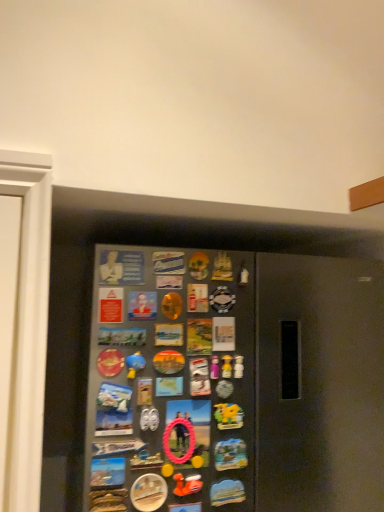
Question: Considering the relative positions of rubber duck at center and matte plastic bust at upper center, marked as the 1th button in a top-to-bottom arrangement, in the image provided, is rubber duck at center to the left of matte plastic bust at upper center, marked as the 1th button in a top-to-bottom arrangement, from the viewer's perspective?

Choices:
 (A) no
 (B) yes

Answer: (A)

Question: Does rubber duck at center have a greater width compared to matte plastic bust at upper center, marked as the 1th button in a top-to-bottom arrangement?

Choices:
 (A) yes
 (B) no

Answer: (A)

Question: Is rubber duck at center looking in the opposite direction of matte plastic bust at upper center, marked as the 1th button in a top-to-bottom arrangement?

Choices:
 (A) yes
 (B) no

Answer: (B)

Question: Does rubber duck at center appear on the right side of matte plastic bust at upper center, marked as the 1th button in a top-to-bottom arrangement?

Choices:
 (A) no
 (B) yes

Answer: (B)

Question: Is matte plastic bust at upper center, positioned as the 6th button in bottom-to-top order, inside rubber duck at center?

Choices:
 (A) yes
 (B) no

Answer: (B)

Question: Is rubber duck at center wider or thinner than rubber duck at lower center?

Choices:
 (A) thin
 (B) wide

Answer: (A)

Question: Is rubber duck at center spatially inside rubber duck at lower center, or outside of it?

Choices:
 (A) inside
 (B) outside

Answer: (B)

Question: Looking at the image, does rubber duck at center seem bigger or smaller compared to rubber duck at lower center?

Choices:
 (A) small
 (B) big

Answer: (A)

Question: Considering the relative positions of rubber duck at center and rubber duck at lower center in the image provided, is rubber duck at center to the left or to the right of rubber duck at lower center?

Choices:
 (A) left
 (B) right

Answer: (B)

Question: From a real-world perspective, is metallic silver button at lower center, which ranks as the 1th button in bottom-to-top order, physically located above or below matte plastic magnet at center, which appears as the 4th button when viewed from the top?

Choices:
 (A) below
 (B) above

Answer: (A)

Question: Is point (153, 475) closer or farther from the camera than point (235, 457)?

Choices:
 (A) closer
 (B) farther

Answer: (A)

Question: Which is correct: metallic silver button at lower center, which ranks as the 1th button in bottom-to-top order, is inside matte plastic magnet at center, which appears as the 4th button when viewed from the top, or outside of it?

Choices:
 (A) inside
 (B) outside

Answer: (B)

Question: Visually, is metallic silver button at lower center, which ranks as the 1th button in bottom-to-top order, positioned to the left or to the right of matte plastic magnet at center, which appears as the 4th button when viewed from the top?

Choices:
 (A) right
 (B) left

Answer: (B)

Question: Relative to metallic blue magnet at lower left, placed as the fifth button when sorted from top to bottom, is metallic gray fridge at center in front or behind?

Choices:
 (A) front
 (B) behind

Answer: (A)

Question: Does point (74, 350) appear closer or farther from the camera than point (104, 479)?

Choices:
 (A) farther
 (B) closer

Answer: (A)